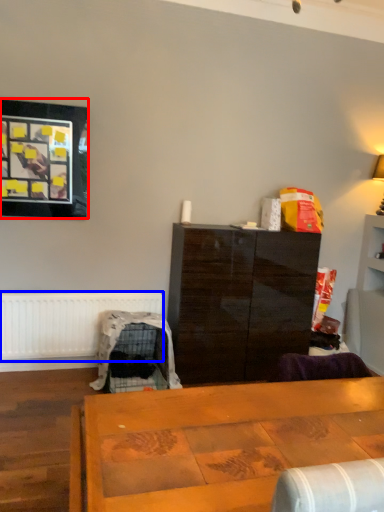
Question: Among these objects, which one is nearest to the camera, picture frame (highlighted by a red box) or radiator (highlighted by a blue box)?

Choices:
 (A) picture frame
 (B) radiator

Answer: (A)